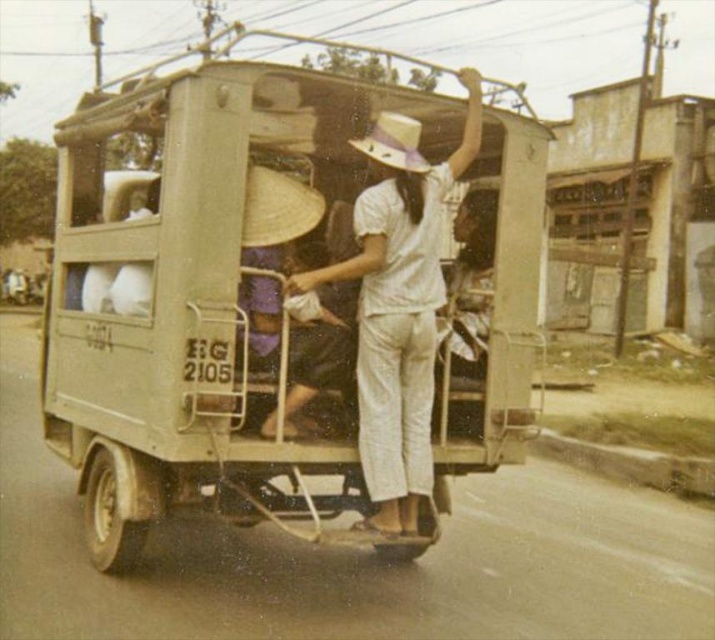
Question: Is matte beige truck at center bigger than white cotton shirt at center?

Choices:
 (A) yes
 (B) no

Answer: (A)

Question: Is matte beige truck at center above white cotton shirt at center?

Choices:
 (A) yes
 (B) no

Answer: (A)

Question: Which point appears closest to the camera in this image?

Choices:
 (A) pyautogui.click(x=389, y=163)
 (B) pyautogui.click(x=413, y=161)
 (C) pyautogui.click(x=325, y=204)
 (D) pyautogui.click(x=388, y=186)

Answer: (A)

Question: Which object is farther from the camera taking this photo?

Choices:
 (A) white straw hat at center
 (B) natural straw hat at center
 (C) matte beige truck at center

Answer: (A)

Question: From the image, what is the correct spatial relationship of matte beige truck at center in relation to white cotton shirt at center?

Choices:
 (A) left
 (B) right

Answer: (A)

Question: Which point is closer to the camera?

Choices:
 (A) white straw hat at center
 (B) white cotton shirt at center
 (C) natural straw hat at center

Answer: (C)